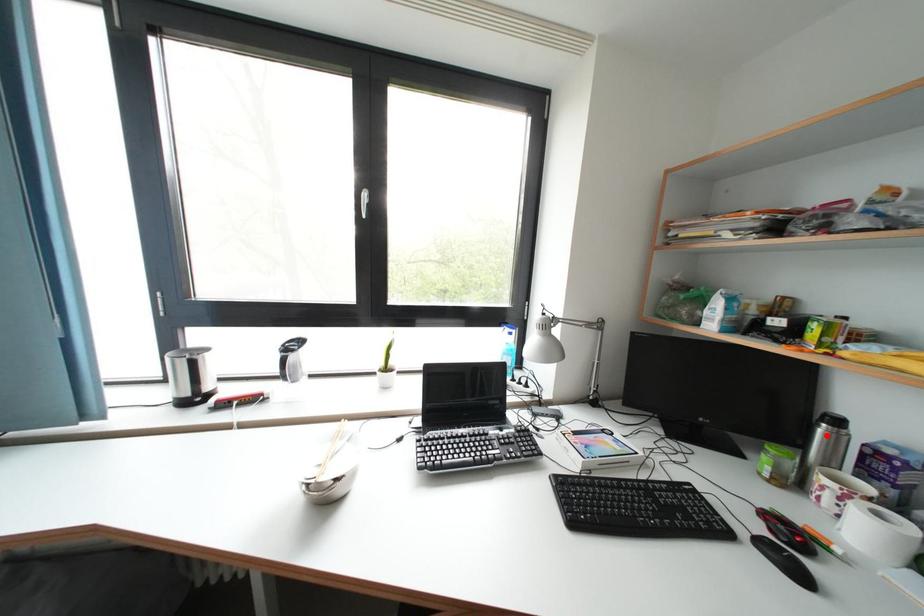
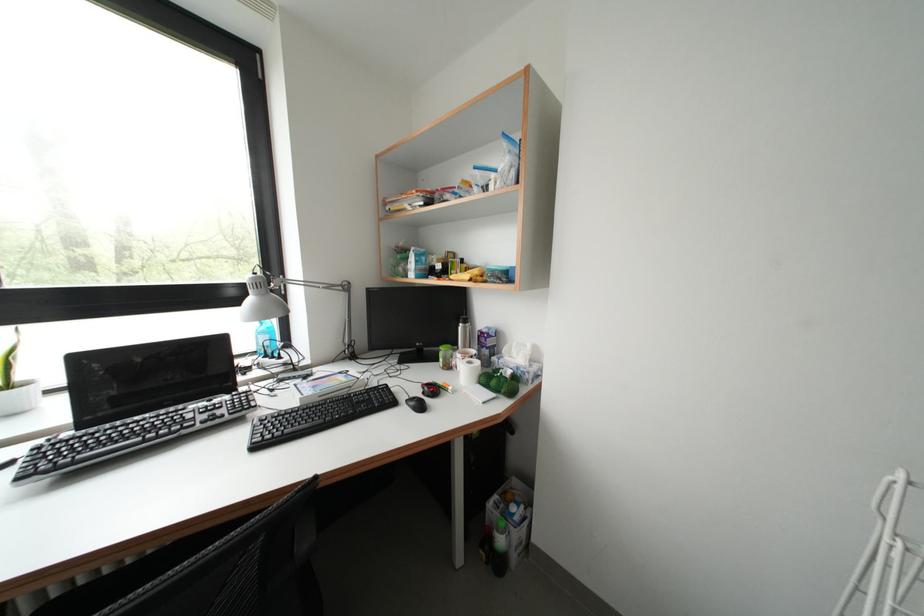
The point at the highlighted location is marked in the first image. Where is the corresponding point in the second image?

(467, 333)